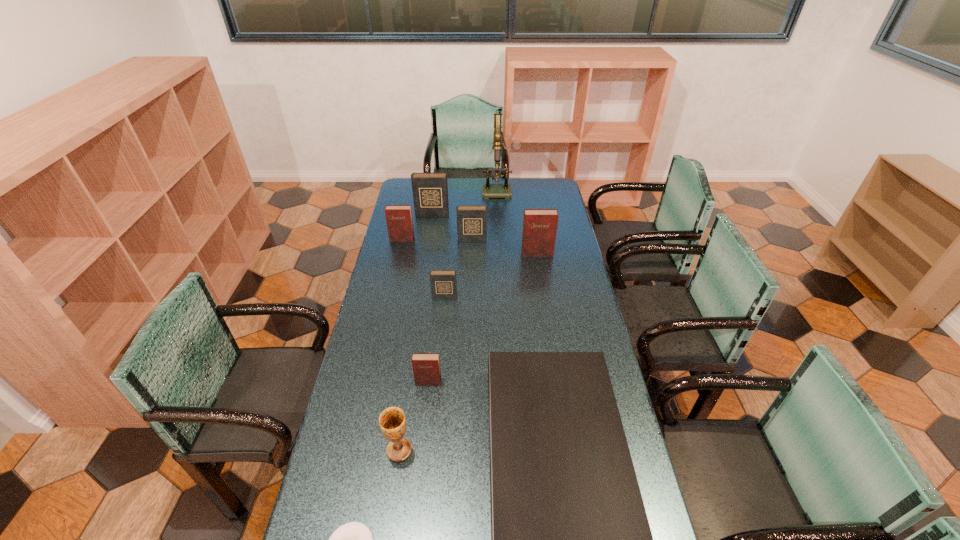
Identify the location of vacant space located on the front cover of the nearest dark diary. This screenshot has height=540, width=960. (444, 310).

Identify the location of free location located 0.240m on the front cover of the nearest reddish-brown diary. The width and height of the screenshot is (960, 540). (420, 454).

Identify the location of object located at the far edge. (489, 190).

Where is `chalice situated at the left edge`? chalice situated at the left edge is located at coordinates (392, 421).

Image resolution: width=960 pixels, height=540 pixels. In order to click on object at the right edge in this screenshot , I will do `click(539, 232)`.

Where is `vacant region at the far edge of the desktop`? This screenshot has height=540, width=960. vacant region at the far edge of the desktop is located at coordinates (511, 179).

This screenshot has width=960, height=540. What are the coordinates of `blank space at the left edge` in the screenshot? It's located at (413, 266).

Where is `vacant space at the far right corner of the desktop`? This screenshot has height=540, width=960. vacant space at the far right corner of the desktop is located at coordinates 536,194.

At what (x,y) coordinates should I click in order to perform the action: click on free space between the chalice and the farthest reddish-brown diary. Please return your answer as a coordinate pair (x, y). Looking at the image, I should click on (400, 345).

Where is `free space between the chalice and the farthest object`? The height and width of the screenshot is (540, 960). free space between the chalice and the farthest object is located at coordinates (449, 320).